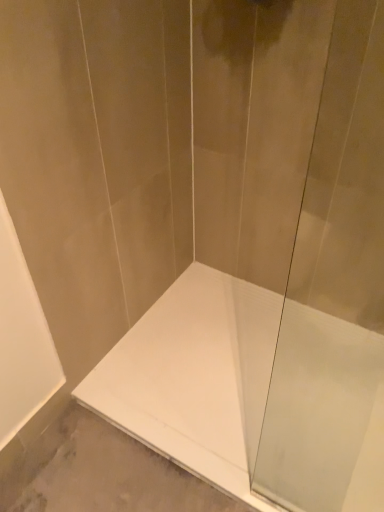
The height and width of the screenshot is (512, 384). Find the location of `unoccupied area behind transparent glass shower door at center`. unoccupied area behind transparent glass shower door at center is located at coordinates (295, 454).